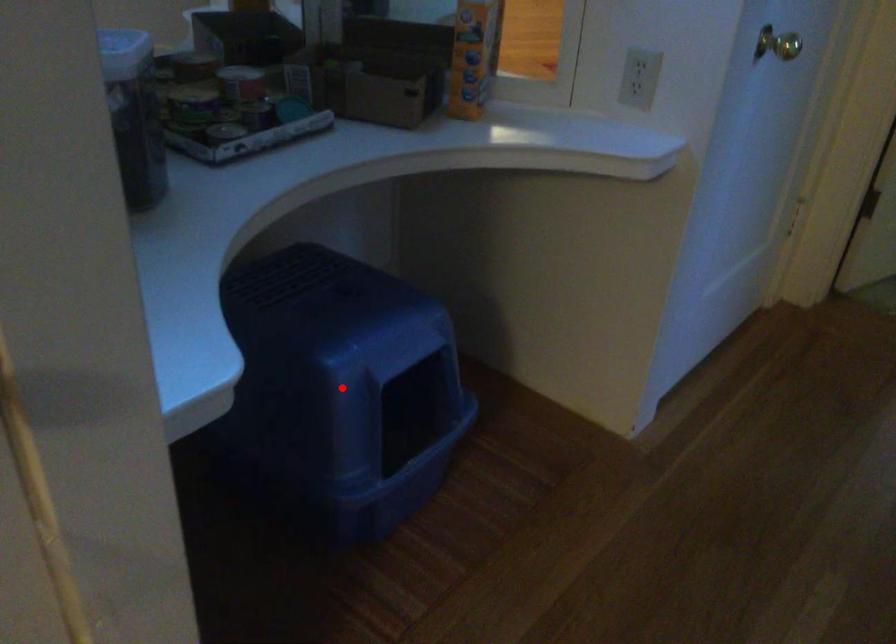
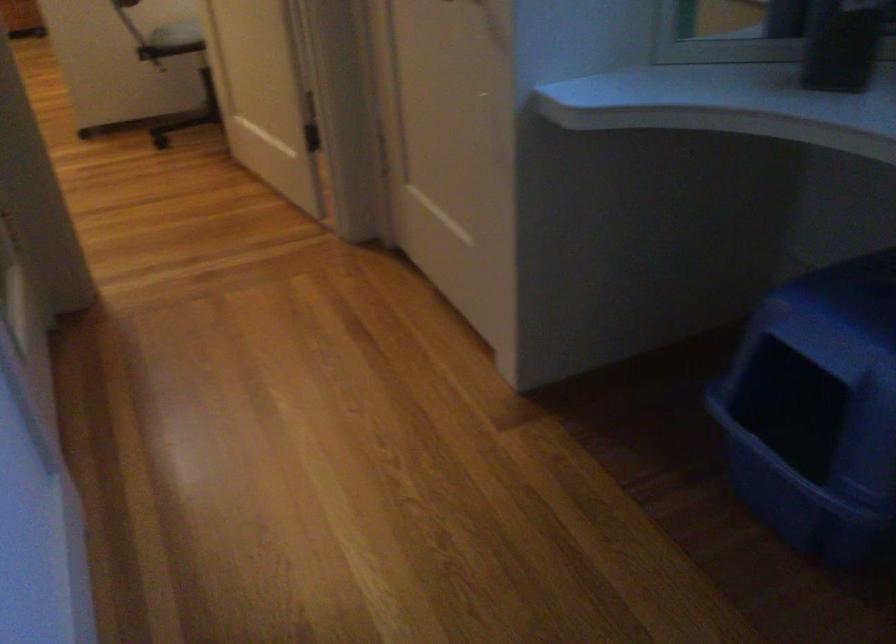
Locate, in the second image, the point that corresponds to the highlighted location in the first image.

(765, 275)